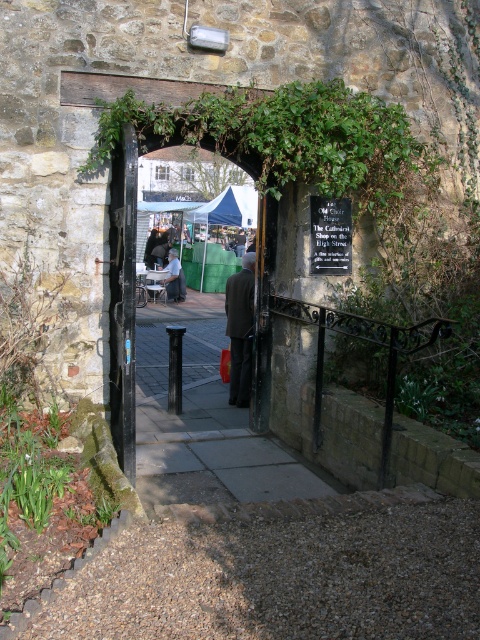
Measure the distance between dark brown suit at center and camera.

dark brown suit at center is 22.72 feet from camera.

Does dark brown suit at center lie in front of light blue denim jacket at center?

Yes, dark brown suit at center is closer to the viewer.

You are a GUI agent. You are given a task and a screenshot of the screen. Output one action in this format:
    pyautogui.click(x=<x>, y=<y>)
    Task: Click on the dark brown suit at center
    
    Given the screenshot: What is the action you would take?
    pyautogui.click(x=240, y=328)

The height and width of the screenshot is (640, 480). What are the coordinates of `dark brown suit at center` in the screenshot? It's located at (240, 328).

Is matte black door at center closer to the viewer compared to dark brown suit at center?

Yes, matte black door at center is in front of dark brown suit at center.

Locate an element on the screen. matte black door at center is located at coordinates (128, 305).

Is point (224, 216) farther from camera compared to point (175, 292)?

That is True.

From the picture: How much distance is there between matte black door at center and light blue denim jacket at center?

matte black door at center and light blue denim jacket at center are 9.00 feet apart.

Does point (239, 188) come farther from viewer compared to point (178, 262)?

Yes.

The width and height of the screenshot is (480, 640). What are the coordinates of `matte black door at center` in the screenshot? It's located at (128, 305).